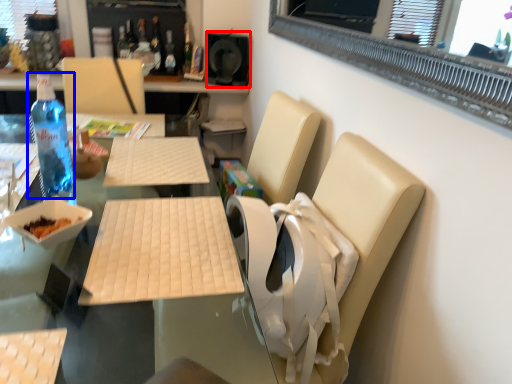
Question: Among these objects, which one is farthest to the camera, speaker (highlighted by a red box) or bottle (highlighted by a blue box)?

Choices:
 (A) speaker
 (B) bottle

Answer: (A)